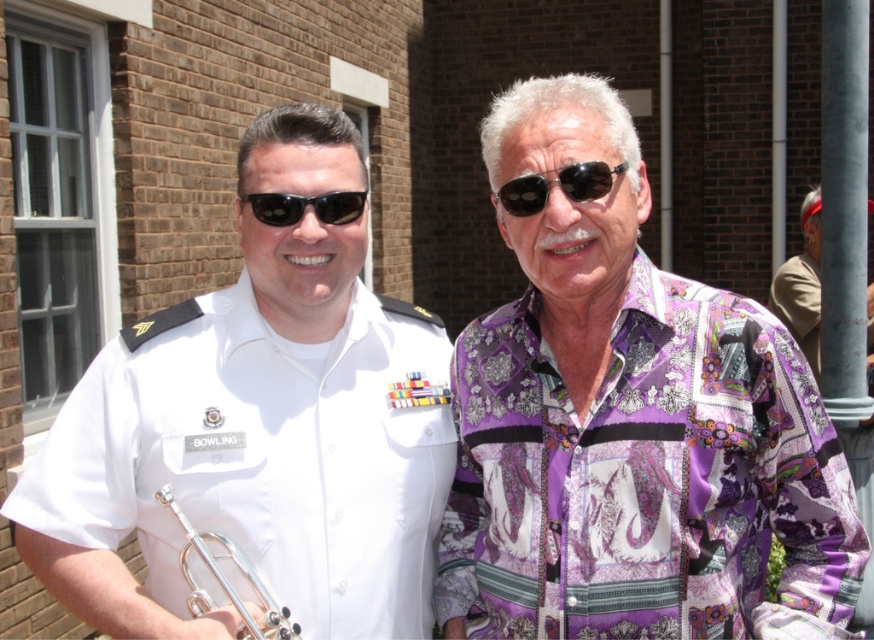
You are a photographer taking a picture of the purple satin shirt at center and the white uniform at center. Which one is closer to your camera?

The purple satin shirt at center is closer to the camera than the white uniform at center because it is further to the viewer.

You are a photographer trying to capture a closeup shot of the silver metallic trumpet at lower left and the black reflective sunglasses at center. Since you want to avoid blurring both objects, you need to know their relative sizes. Which object is wider?

The silver metallic trumpet at lower left might be wider than black reflective sunglasses at center.